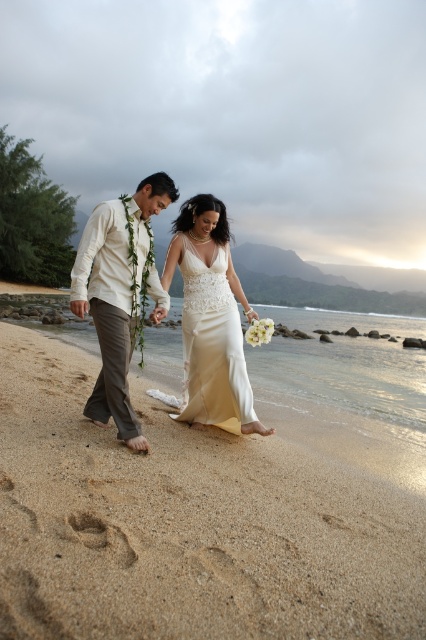
Question: Can you confirm if light beige sand at lower center is positioned below brown sandy footprint at lower center?

Choices:
 (A) no
 (B) yes

Answer: (B)

Question: Is ivory satin dress at center further to camera compared to brown sandy footprint at lower center?

Choices:
 (A) no
 (B) yes

Answer: (B)

Question: Does ivory satin dress at center appear over brown sandy footprint at lower center?

Choices:
 (A) yes
 (B) no

Answer: (A)

Question: Based on their relative distances, which object is farther from the ivory satin dress at center?

Choices:
 (A) light beige sand at lower center
 (B) white cotton shirt at center
 (C) brown sandy footprint at lower center

Answer: (C)

Question: Among these objects, which one is farthest from the camera?

Choices:
 (A) white cotton shirt at center
 (B) ivory satin dress at center
 (C) light beige sand at lower center

Answer: (B)

Question: Which of the following is the farthest from the observer?

Choices:
 (A) white cotton shirt at center
 (B) brown sandy footprint at lower center
 (C) light beige sand at lower center

Answer: (A)